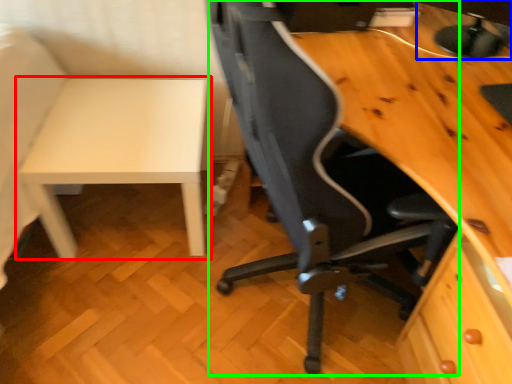
Question: Which is nearer to the table (highlighted by a red box)? computer monitor (highlighted by a blue box) or chair (highlighted by a green box).

Choices:
 (A) computer monitor
 (B) chair

Answer: (B)